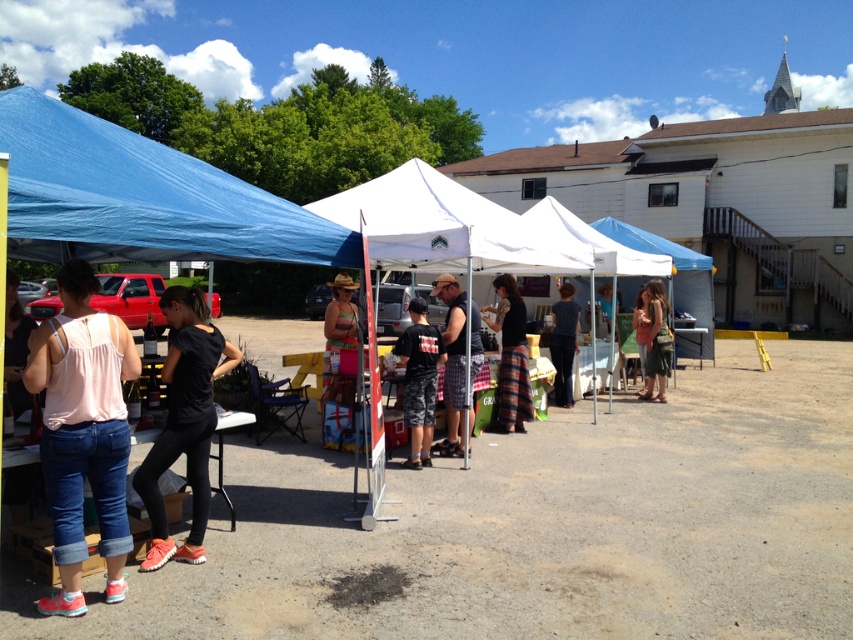
Question: Considering the relative positions of green fabric skirt at center and matte pink shirt at center in the image provided, where is green fabric skirt at center located with respect to matte pink shirt at center?

Choices:
 (A) right
 (B) left

Answer: (A)

Question: Among these objects, which one is farthest from the camera?

Choices:
 (A) blue fabric at center
 (B) black cotton t-shirt at center

Answer: (A)

Question: Which point is closer to the camera taking this photo?

Choices:
 (A) (206, 353)
 (B) (53, 209)

Answer: (B)

Question: Can you confirm if black matte shirt at center is bigger than camouflage shorts at center?

Choices:
 (A) yes
 (B) no

Answer: (B)

Question: In this image, where is blue tarp canopy at left located relative to white fabric tent at center?

Choices:
 (A) above
 (B) below

Answer: (A)

Question: Which object is farther from the camera taking this photo?

Choices:
 (A) white fabric tent at center
 (B) pink fabric tank top at left
 (C) matte pink shirt at center

Answer: (C)